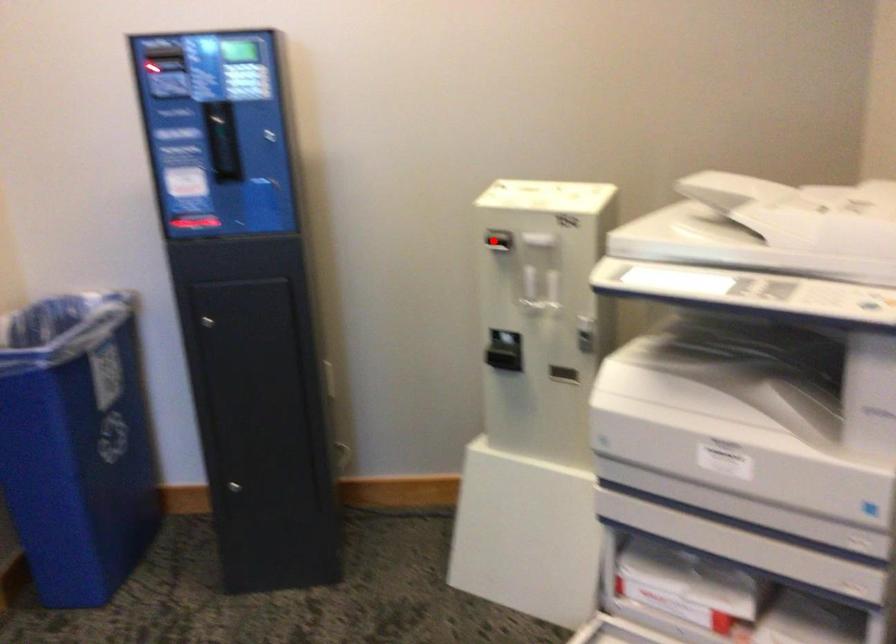
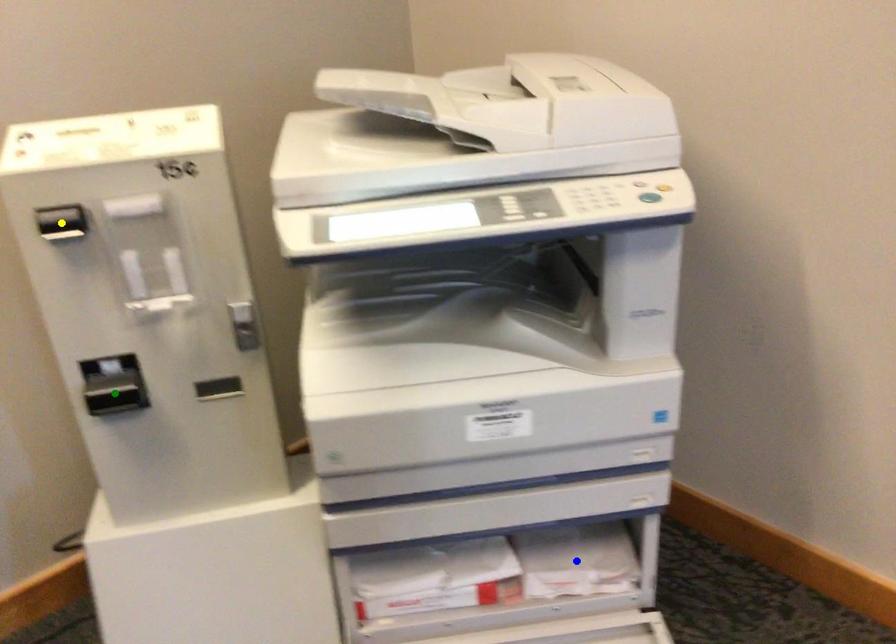
Question: I am providing you with two images of the same scene from different viewpoints. A red point is marked on the first image. You are given multiple points on the second image. In image 2, which mark is for the same physical point as the one in image 1?

Choices:
 (A) green point
 (B) blue point
 (C) yellow point

Answer: (C)